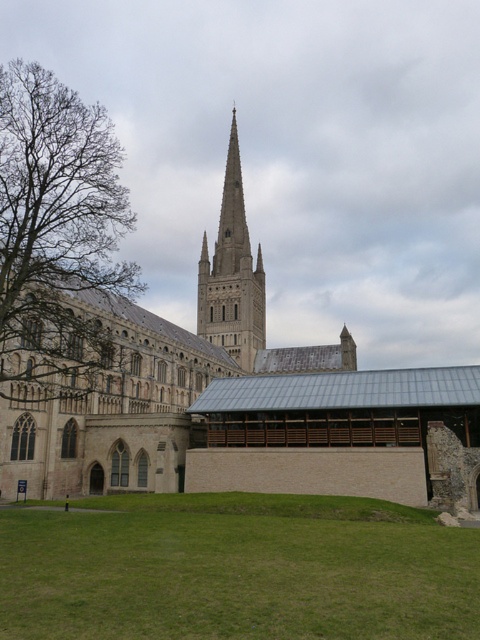
Measure the distance between beige stone church at center and camera.

51.15 meters

Based on the photo, measure the distance from beige stone church at center to brown leafy tree at left.

17.15 meters

Is point (112, 467) behind point (0, 218)?

Yes, it is.

At what (x,y) coordinates should I click in order to perform the action: click on beige stone church at center. Please return your answer as a coordinate pair (x, y). Image resolution: width=480 pixels, height=640 pixels. Looking at the image, I should click on (239, 403).

Does beige stone church at center lie in front of green grass at lower center?

That is False.

Can you confirm if beige stone church at center is positioned to the right of green grass at lower center?

Correct, you'll find beige stone church at center to the right of green grass at lower center.

The width and height of the screenshot is (480, 640). What are the coordinates of `beige stone church at center` in the screenshot? It's located at (239, 403).

Identify the location of beige stone church at center. (239, 403).

Between beige stone church at center and stone spire at center, which one is positioned lower?

beige stone church at center is below.

Between beige stone church at center and stone spire at center, which one is positioned higher?

stone spire at center

Who is more forward, (132, 326) or (231, 349)?

Point (132, 326) is more forward.

Identify the location of beige stone church at center. (239, 403).